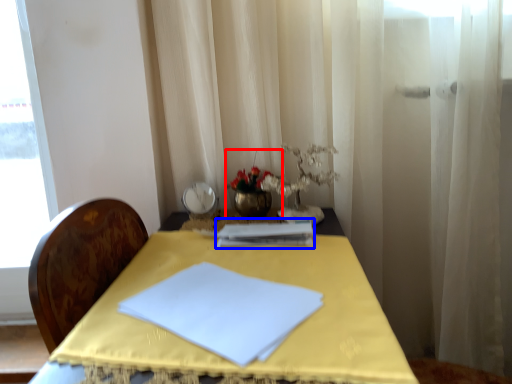
Question: Which of the following is the closest to the observer, floral arrangement (highlighted by a red box) or journal (highlighted by a blue box)?

Choices:
 (A) floral arrangement
 (B) journal

Answer: (B)